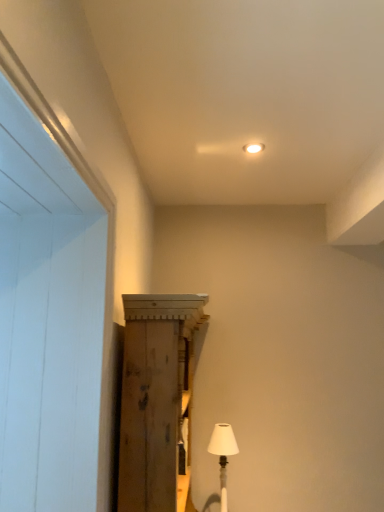
Question: From a real-world perspective, is wooden cabinet at center above or below white fabric lampshade at lower right?

Choices:
 (A) above
 (B) below

Answer: (A)

Question: In terms of height, does wooden cabinet at center look taller or shorter compared to white fabric lampshade at lower right?

Choices:
 (A) short
 (B) tall

Answer: (B)

Question: Is wooden cabinet at center situated inside white fabric lampshade at lower right or outside?

Choices:
 (A) outside
 (B) inside

Answer: (A)

Question: Relative to wooden cabinet at center, is white fabric lampshade at lower right in front or behind?

Choices:
 (A) behind
 (B) front

Answer: (A)

Question: Considering the positions of point (231, 454) and point (137, 366), is point (231, 454) closer or farther from the camera than point (137, 366)?

Choices:
 (A) farther
 (B) closer

Answer: (A)

Question: From their relative heights in the image, would you say white fabric lampshade at lower right is taller or shorter than wooden cabinet at center?

Choices:
 (A) short
 (B) tall

Answer: (A)

Question: In terms of width, does white fabric lampshade at lower right look wider or thinner when compared to wooden cabinet at center?

Choices:
 (A) wide
 (B) thin

Answer: (B)